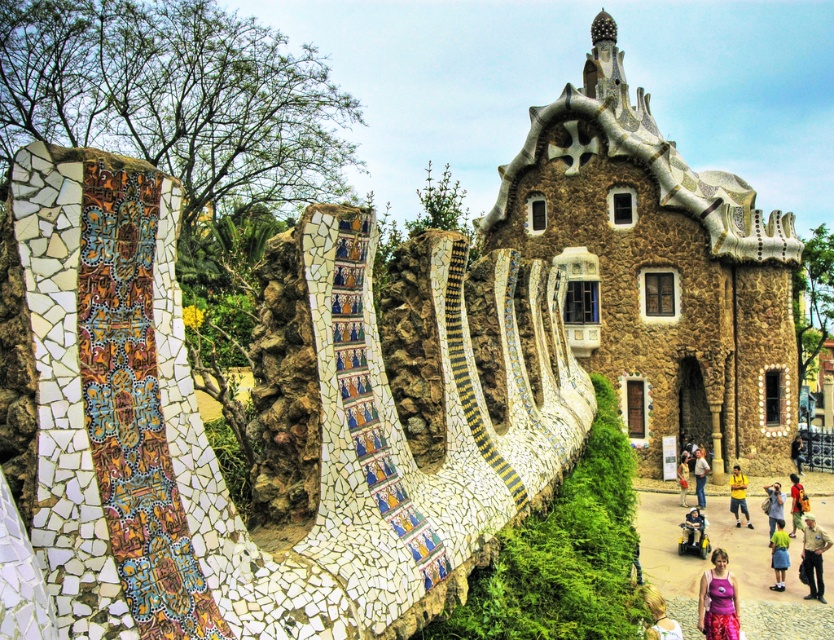
Question: Does purple fabric at lower right have a lesser width compared to yellow shirt at center?

Choices:
 (A) yes
 (B) no

Answer: (A)

Question: Which of the following is the farthest from the observer?

Choices:
 (A) yellow fabric bag at lower right
 (B) light blue denim jeans at lower right

Answer: (A)

Question: Which point is closer to the camera taking this photo?

Choices:
 (A) (781, 545)
 (B) (811, 518)
 (C) (799, 481)
 (D) (789, 577)

Answer: (A)

Question: Is yellow shirt at center closer to the viewer compared to dark blue fabric at lower right?

Choices:
 (A) yes
 (B) no

Answer: (A)

Question: Which object is closer to the camera taking this photo?

Choices:
 (A) yellow shirt at center
 (B) light blue denim shorts at lower right

Answer: (A)

Question: Is yellow fabric shirt at lower right wider than dark blue fabric at lower right?

Choices:
 (A) no
 (B) yes

Answer: (B)